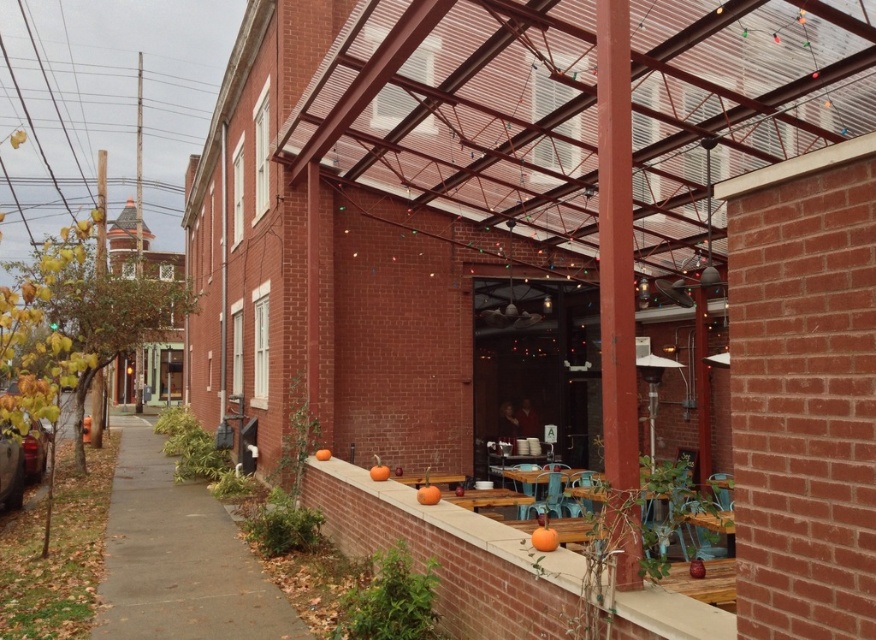
Question: Can you confirm if transparent plastic canopy at upper center is positioned to the right of gray concrete sidewalk at lower left?

Choices:
 (A) yes
 (B) no

Answer: (A)

Question: Which point is closer to the camera taking this photo?

Choices:
 (A) (198, 588)
 (B) (590, 86)

Answer: (A)

Question: Which of the following is the farthest from the observer?

Choices:
 (A) transparent plastic canopy at upper center
 (B) gray concrete sidewalk at lower left

Answer: (A)

Question: Does transparent plastic canopy at upper center appear on the left side of gray concrete sidewalk at lower left?

Choices:
 (A) no
 (B) yes

Answer: (A)

Question: Which of the following is the farthest from the observer?

Choices:
 (A) (406, 184)
 (B) (195, 508)

Answer: (A)

Question: Is transparent plastic canopy at upper center to the left of gray concrete sidewalk at lower left from the viewer's perspective?

Choices:
 (A) no
 (B) yes

Answer: (A)